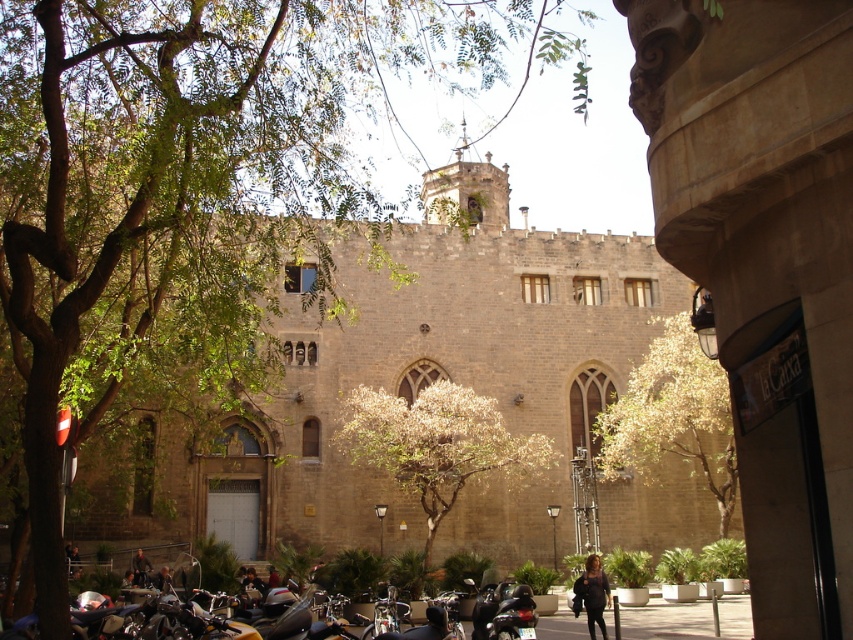
Does green leafy tree at center lie behind shiny black motorcycle at lower center?

Yes, it is behind shiny black motorcycle at lower center.

Who is more distant from viewer, (724, 392) or (486, 637)?

Positioned behind is point (724, 392).

Does point (653, 378) lie in front of point (531, 637)?

No, (653, 378) is behind (531, 637).

Locate an element on the screen. green leafy tree at center is located at coordinates (672, 417).

This screenshot has width=853, height=640. What do you see at coordinates (184, 195) in the screenshot?
I see `green leafy tree at upper left` at bounding box center [184, 195].

Does green leafy tree at upper left appear under green leafy tree at center?

No.

Is point (108, 211) in front of point (672, 348)?

That is True.

This screenshot has height=640, width=853. I want to click on green leafy tree at upper left, so pos(184,195).

Does point (480, 432) lie in front of point (517, 586)?

No, it is behind (517, 586).

Is golden textured tree at center taller than shiny black motorcycle at lower center?

Indeed, golden textured tree at center has a greater height compared to shiny black motorcycle at lower center.

Where is `golden textured tree at center`? Image resolution: width=853 pixels, height=640 pixels. golden textured tree at center is located at coordinates (437, 444).